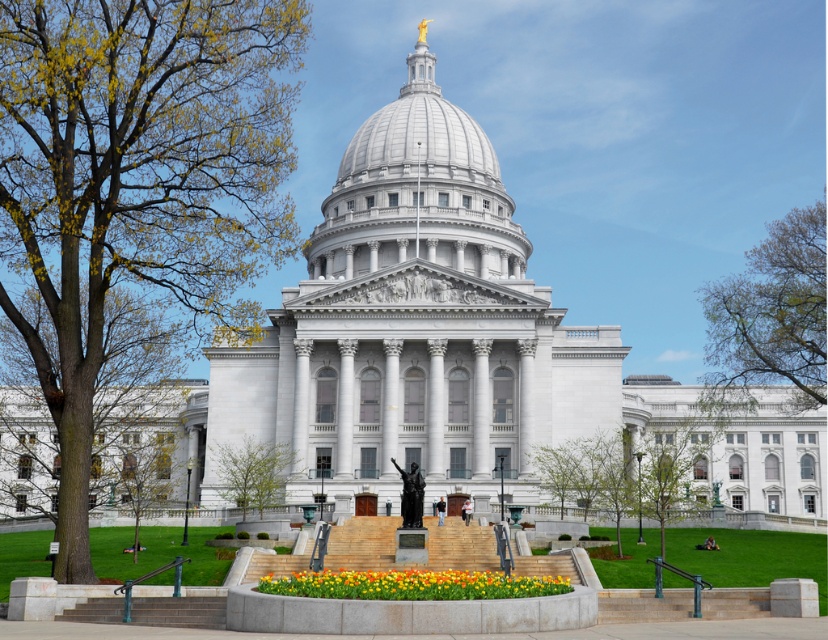
Question: Among these points, which one is farthest from the camera?

Choices:
 (A) (256, 486)
 (B) (461, 595)
 (C) (135, 515)
 (D) (325, 276)

Answer: (D)

Question: Which point is farther to the camera?

Choices:
 (A) brown leafy tree at upper right
 (B) green leafy tree at center

Answer: (A)

Question: Which object is farther from the camera taking this photo?

Choices:
 (A) brown leafy tree at upper right
 (B) green leafy tree at lower left
 (C) vibrant tulips at center
 (D) white marble dome at center

Answer: (D)

Question: Can you confirm if green leafy tree at left is wider than white marble dome at center?

Choices:
 (A) yes
 (B) no

Answer: (A)

Question: Observing the image, what is the correct spatial positioning of brown leafy tree at upper right in reference to concrete steps at center?

Choices:
 (A) above
 (B) below

Answer: (A)

Question: Can you confirm if brown leafy tree at upper right is thinner than green leafy tree at lower left?

Choices:
 (A) no
 (B) yes

Answer: (A)